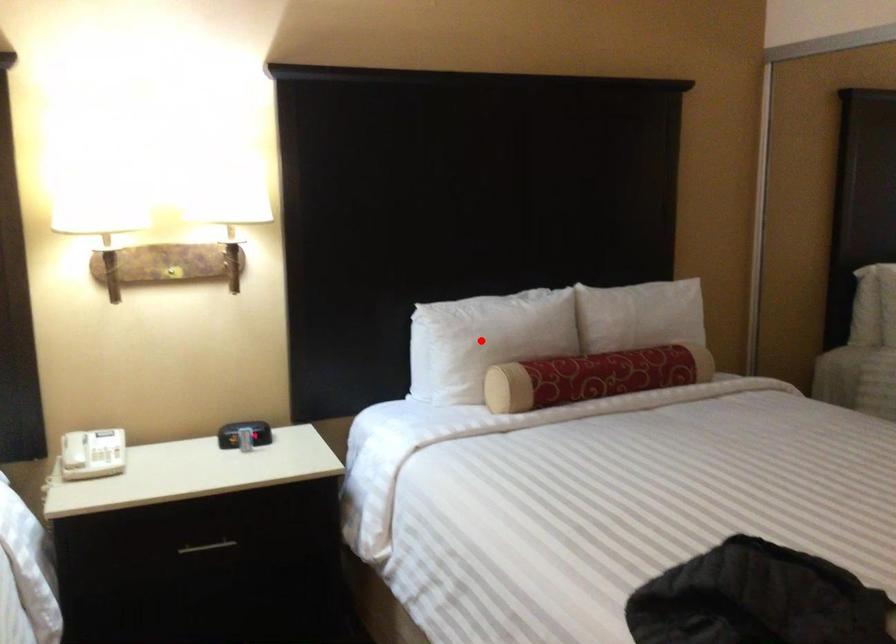
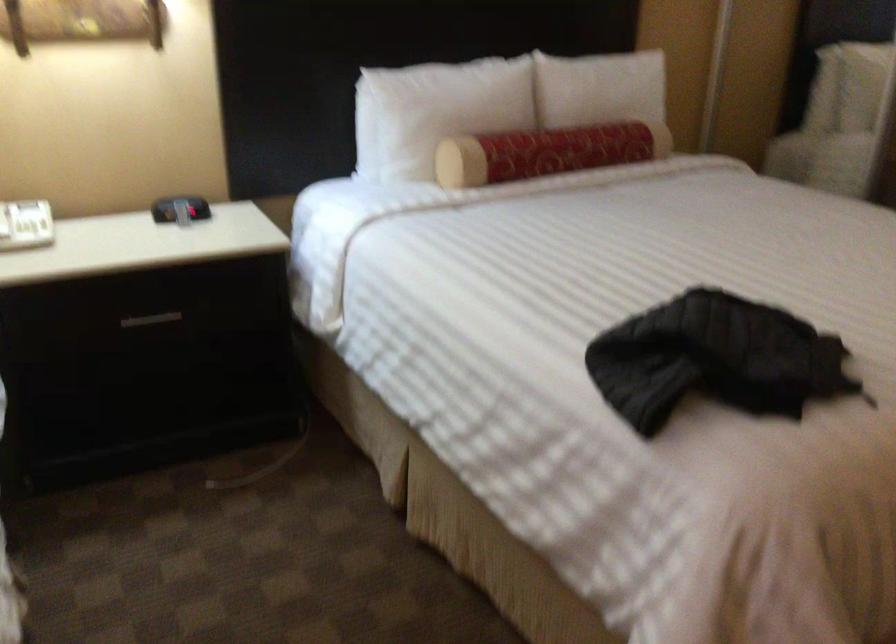
Where in the second image is the point corresponding to the highlighted location from the first image?

(435, 111)